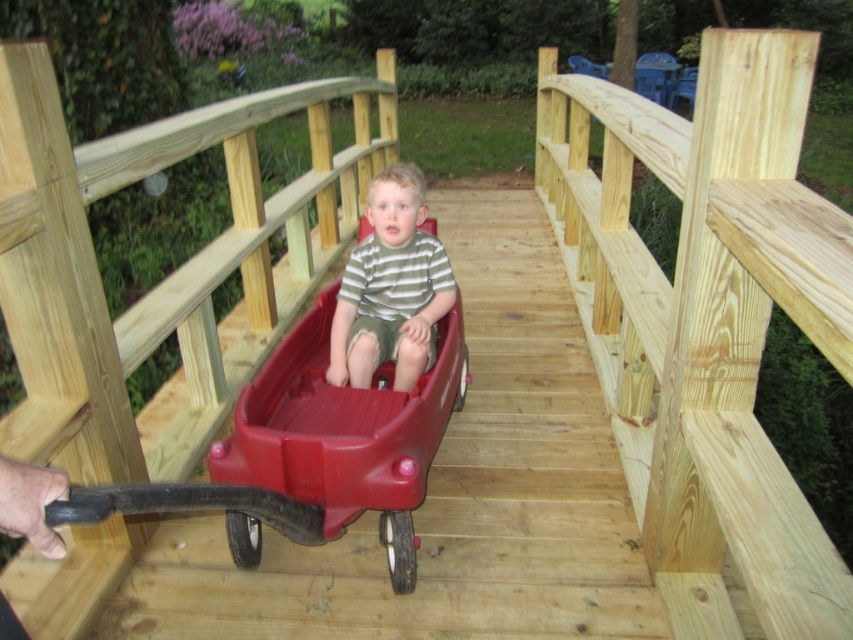
Question: Which object appears closest to the camera in this image?

Choices:
 (A) natural wood rail at center
 (B) striped cotton shirt at center

Answer: (A)

Question: Where is rubberized plastic wagon at center located in relation to striped cotton shirt at center in the image?

Choices:
 (A) above
 (B) below

Answer: (B)

Question: Which object appears farthest from the camera in this image?

Choices:
 (A) striped cotton shirt at center
 (B) natural wood rail at center

Answer: (A)

Question: Which is farther from the striped cotton shirt at center?

Choices:
 (A) rubberized plastic wagon at center
 (B) natural wood rail at center

Answer: (B)

Question: In this image, where is rubberized plastic wagon at center located relative to striped cotton shirt at center?

Choices:
 (A) left
 (B) right

Answer: (A)

Question: Can you confirm if rubberized plastic wagon at center is bigger than striped cotton shirt at center?

Choices:
 (A) no
 (B) yes

Answer: (B)